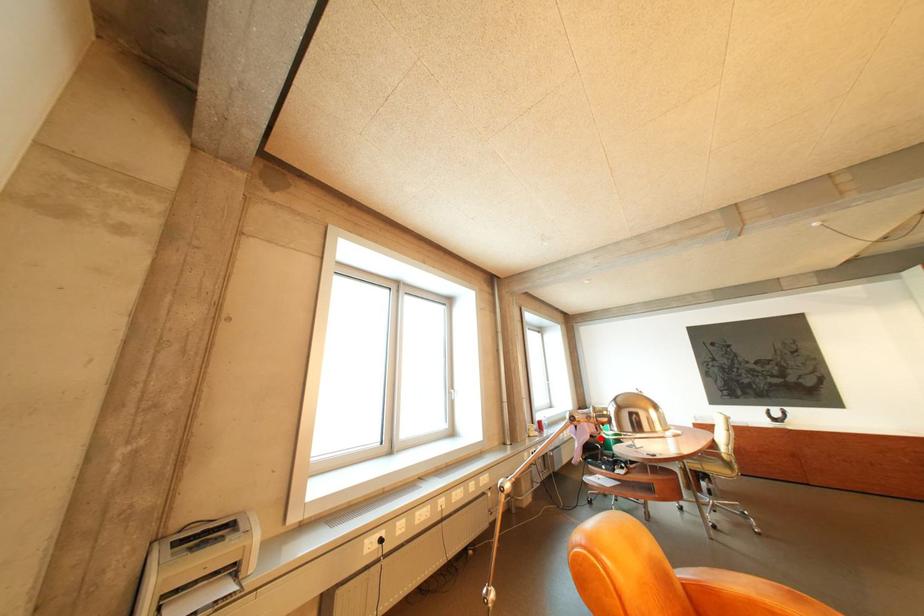
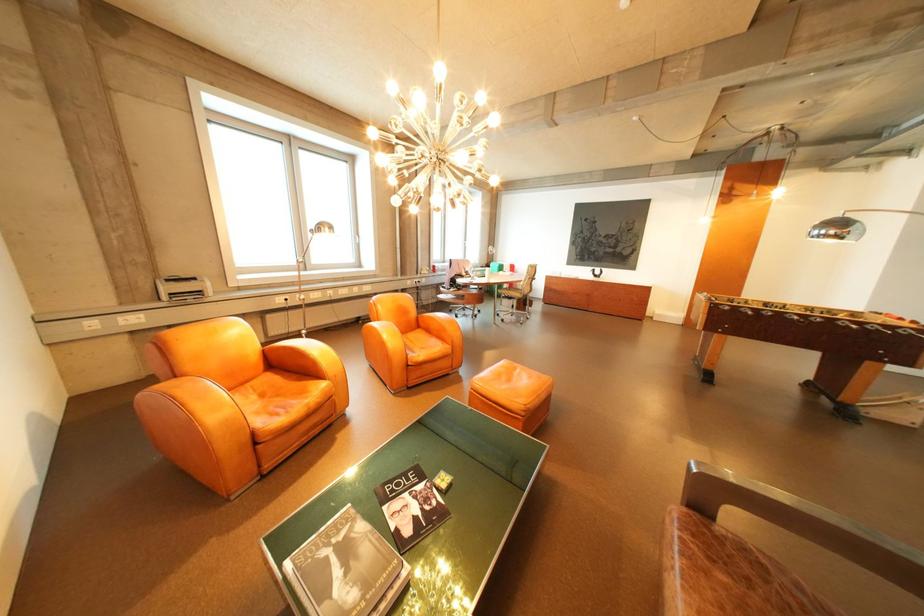
Find the pixel in the second image that matches the highlighted location in the first image.

(467, 276)